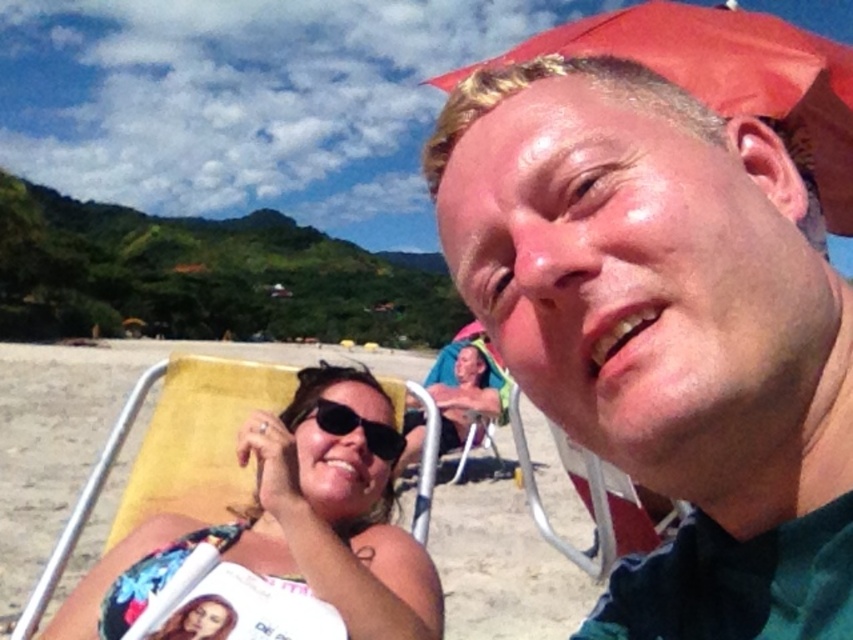
You are a photographer trying to capture the perfect shot of the beach scene. You notice a matte green shirt at center located at point (665, 330). To avoid including this shirt in your photo, where should you position your camera relative to this point?

To avoid including the matte green shirt at center located at point (665, 330), position your camera above this point since the shirt is at the center and moving above would exclude it from the frame.